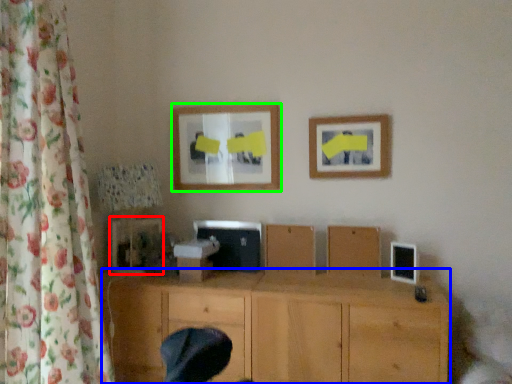
Question: Which object is the farthest from picture frame (highlighted by a red box)? Choose among these: wood (highlighted by a blue box) or picture frame (highlighted by a green box).

Choices:
 (A) wood
 (B) picture frame

Answer: (A)